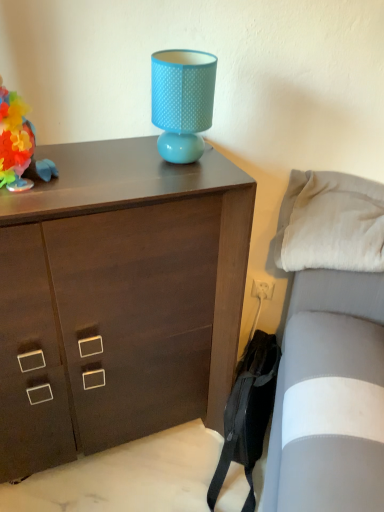
I want to click on free location above dark wood chest of drawers at upper center (from a real-world perspective), so click(99, 167).